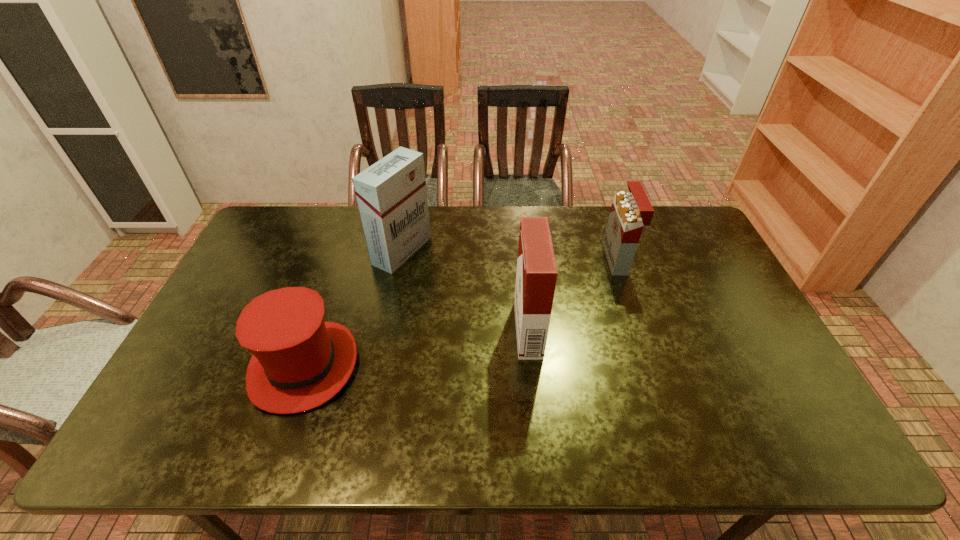
The image size is (960, 540). Identify the location of empty space that is in between the shortest object and the shortest cigarette case. (461, 313).

The width and height of the screenshot is (960, 540). Identify the location of vacant space in between the leftmost cigarette case and the shortest object. (353, 308).

This screenshot has width=960, height=540. What are the coordinates of `free point between the second cigarette case from right to left and the leftmost cigarette case` in the screenshot? It's located at (465, 290).

Identify the location of unoccupied position between the shortest cigarette case and the shortest object. The height and width of the screenshot is (540, 960). (461, 313).

Where is `vacant space that's between the leftmost cigarette case and the second object from right to left`? This screenshot has width=960, height=540. vacant space that's between the leftmost cigarette case and the second object from right to left is located at coordinates [465, 290].

Identify the location of vacant point located between the second shortest object and the shortest object. The height and width of the screenshot is (540, 960). (461, 313).

Where is `vacant area that lies between the shortest object and the leftmost cigarette case`? This screenshot has height=540, width=960. vacant area that lies between the shortest object and the leftmost cigarette case is located at coordinates (353, 308).

Identify the location of free space that is in between the leftmost cigarette case and the hat. (353, 308).

I want to click on free space between the third tallest object and the leftmost cigarette case, so click(x=510, y=255).

Identify which object is located as the third nearest to the rightmost object. Please provide its 2D coordinates. Your answer should be formatted as a tuple, i.e. [(x, y)], where the tuple contains the x and y coordinates of a point satisfying the conditions above.

[(299, 362)]